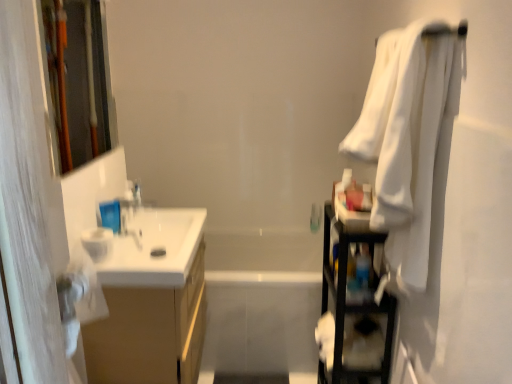
The image size is (512, 384). I want to click on free point to the right of clear plastic bottle at upper left, so click(x=166, y=216).